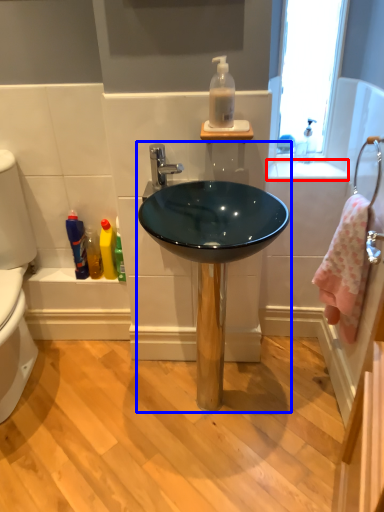
Question: Which of the following is the closest to the observer, counter top (highlighted by a red box) or sink (highlighted by a blue box)?

Choices:
 (A) counter top
 (B) sink

Answer: (B)